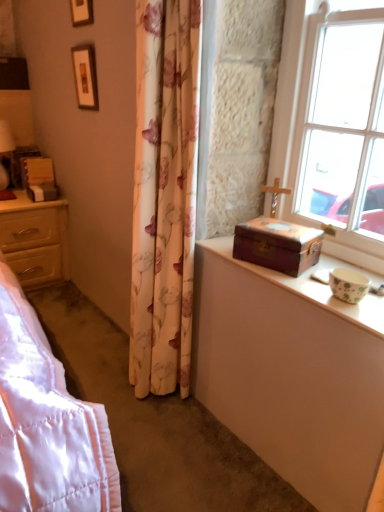
Image resolution: width=384 pixels, height=512 pixels. What are the coordinates of `free point above wooden treasure chest at window sill (from a real-world perspective)` in the screenshot? It's located at (285, 232).